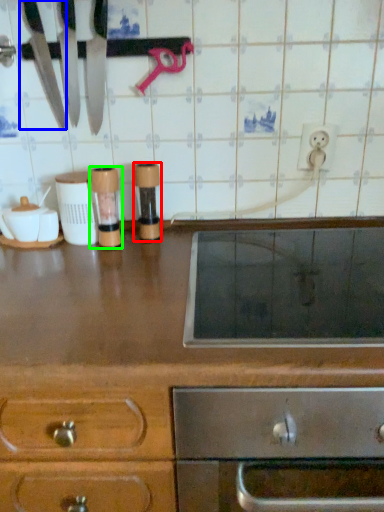
Question: Which is farther away from appliance (highlighted by a red box)? knife (highlighted by a blue box) or appliance (highlighted by a green box)?

Choices:
 (A) knife
 (B) appliance

Answer: (A)